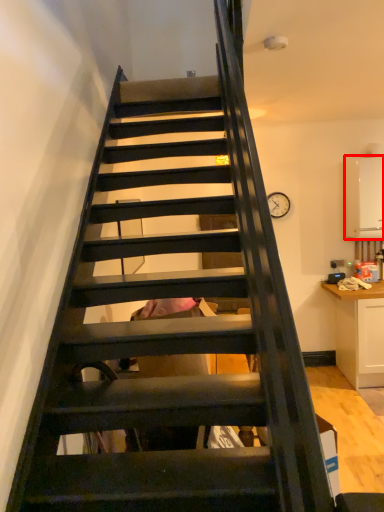
Question: In this image, where is appliance (annotated by the red box) located relative to cardboard box?

Choices:
 (A) right
 (B) left

Answer: (A)